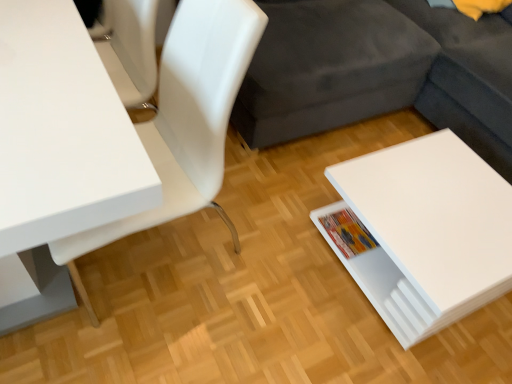
Question: Is point (72, 215) closer or farther from the camera than point (169, 163)?

Choices:
 (A) farther
 (B) closer

Answer: (B)

Question: Would you say white glossy table at left, placed as the second table when sorted from right to left, is to the left or to the right of white glossy chair at upper left in the picture?

Choices:
 (A) left
 (B) right

Answer: (A)

Question: Which is nearer to the white glossy table at lower right, marked as the 2th table in a left-to-right arrangement?

Choices:
 (A) white glossy chair at upper left
 (B) multicolored paper book at lower right
 (C) white glossy table at left, the 1th table in the left-to-right sequence

Answer: (B)

Question: Considering the real-world distances, which object is closest to the white glossy table at left, placed as the second table when sorted from right to left?

Choices:
 (A) multicolored paper book at lower right
 (B) white glossy chair at upper left
 (C) white glossy table at lower right, the first table from the right

Answer: (B)